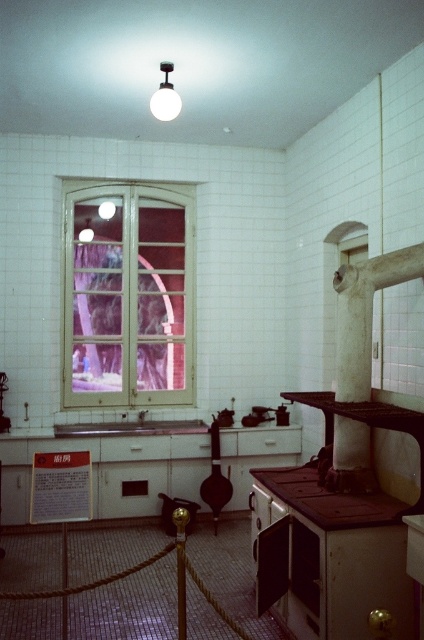
You are a chef preparing to move the brown matte stove at lower right closer to the white glossy sink at center. Considering their sizes, will the stove fit in the space currently occupied by the sink?

The brown matte stove at lower right occupies less space than the white glossy sink at center, so the stove can fit in the space currently occupied by the sink since it is smaller in size.

You are a kitchen designer planning to install a new 36 inch wide cabinet between the white wooden window at center and the white glossy sink at center. Can the cabinet fit in the space between them?

The distance between the white wooden window at center and the white glossy sink at center is 35.68 inches. Since the cabinet is 36 inches wide, it is slightly wider than the available space. Therefore, the cabinet cannot fit between them.